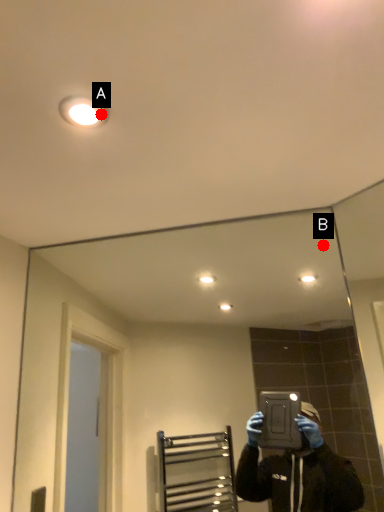
Question: Two points are circled on the image, labeled by A and B beside each circle. Which point is further to the camera?

Choices:
 (A) A is further
 (B) B is further

Answer: (B)